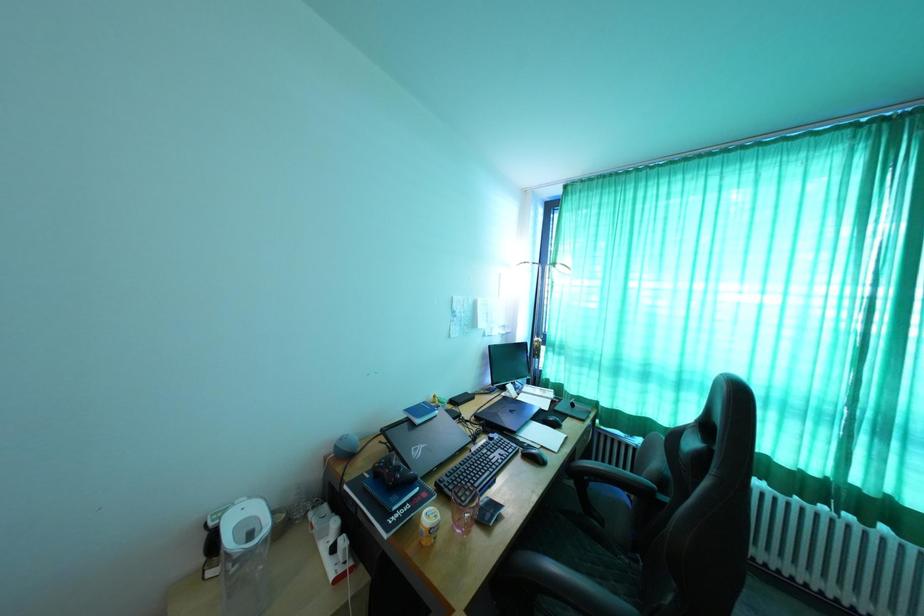
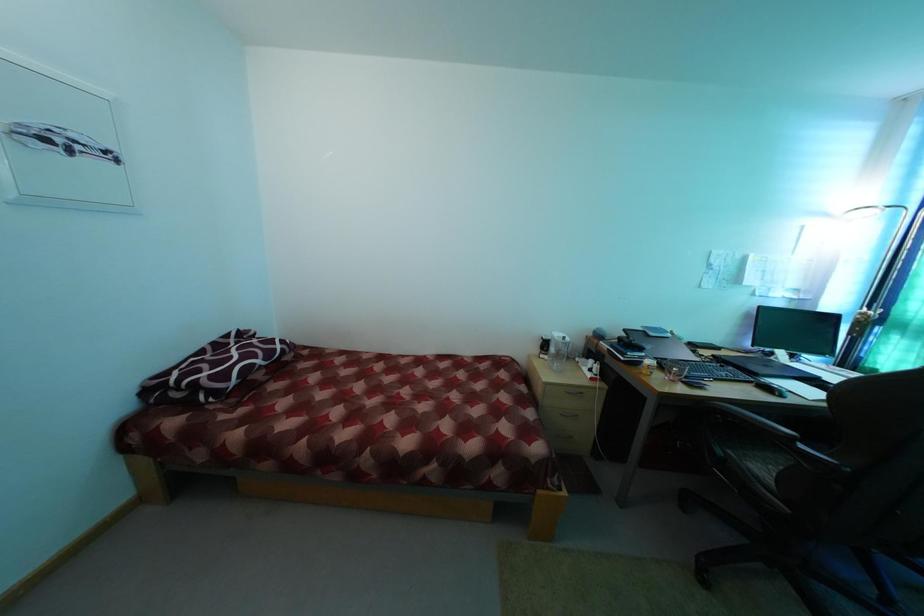
Question: The camera is either moving clockwise (left) or counter-clockwise (right) around the object. The first image is from the beginning of the video and the second image is from the end. Is the camera moving left or right when shooting the video?

Choices:
 (A) Left
 (B) Right

Answer: (B)